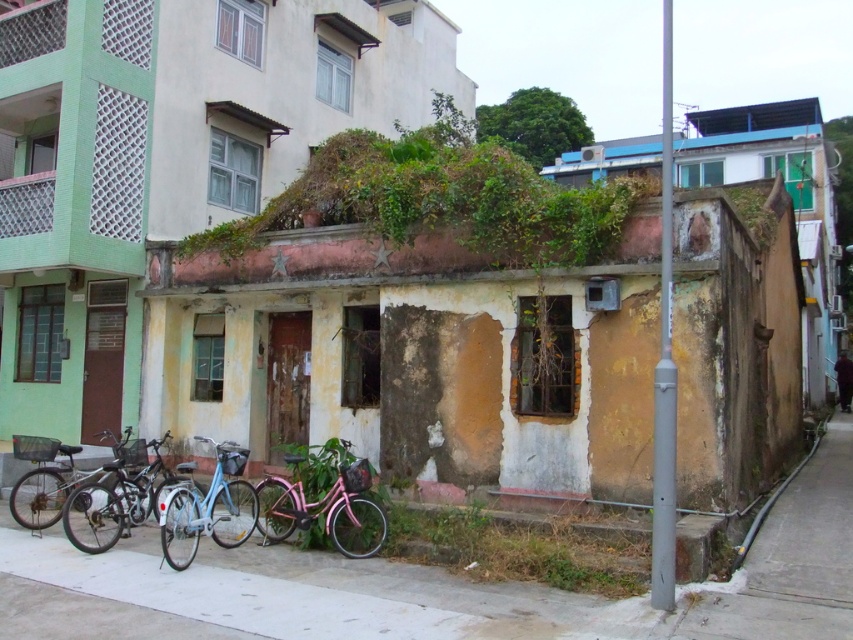
Question: Which object is closer to the camera taking this photo?

Choices:
 (A) concrete pavement at lower center
 (B) metallic silver bicycle at lower left
 (C) matte blue bicycle at center

Answer: (A)

Question: Is concrete pavement at lower center to the right of pink matte bicycle at center from the viewer's perspective?

Choices:
 (A) yes
 (B) no

Answer: (A)

Question: Can you confirm if concrete pavement at lower center is positioned below brushed metal bicycle at lower left?

Choices:
 (A) no
 (B) yes

Answer: (B)

Question: Among these points, which one is farthest from the camera?

Choices:
 (A) (532, 602)
 (B) (294, 518)
 (C) (241, 484)

Answer: (C)

Question: Can you confirm if matte blue bicycle at center is positioned above metallic silver bicycle at lower left?

Choices:
 (A) no
 (B) yes

Answer: (B)

Question: Which object is positioned farthest from the brushed metal bicycle at lower left?

Choices:
 (A) metallic silver bicycle at lower left
 (B) matte blue bicycle at center
 (C) concrete pavement at lower center
 (D) pink matte bicycle at center

Answer: (D)